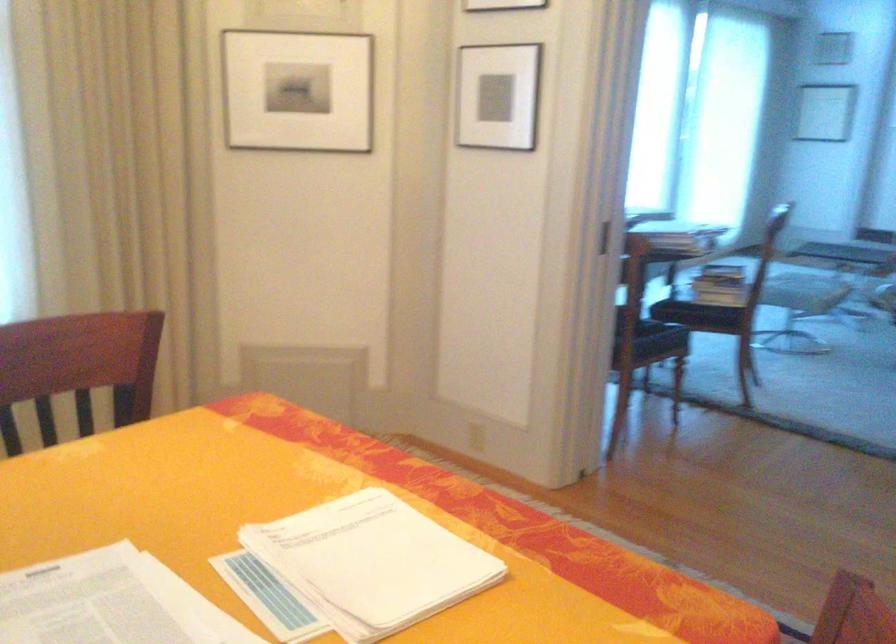
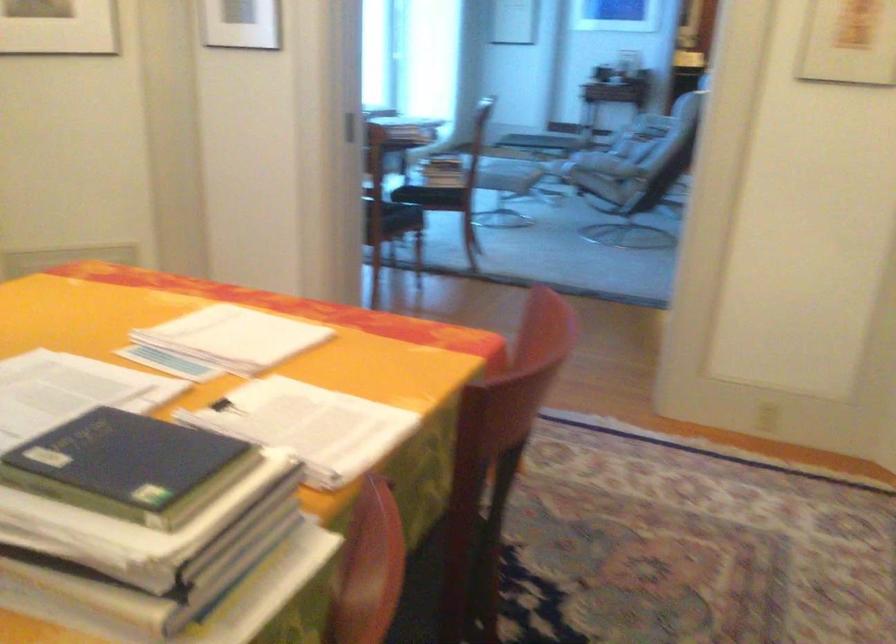
What movement of the cameraman would produce the second image?

The cameraman walked toward left, backward.